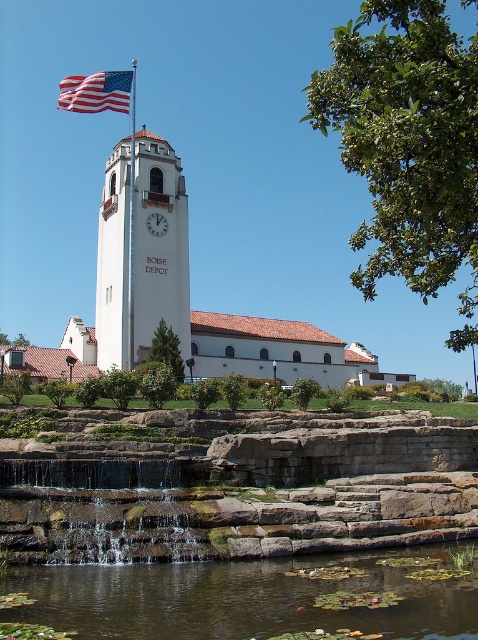
Question: Which point is farther from the camera taking this photo?

Choices:
 (A) (132, 323)
 (B) (108, 225)
 (C) (76, 582)
 (D) (147, 220)

Answer: (B)

Question: Observing the image, what is the correct spatial positioning of american flag at upper left in reference to metallic flagpole at upper left?

Choices:
 (A) right
 (B) left

Answer: (B)

Question: Which of these objects is positioned closest to the transparent water at lower center?

Choices:
 (A) white smooth clock tower at center
 (B) american flag at upper left
 (C) white matte clock at center
 (D) metallic flagpole at upper left

Answer: (D)

Question: Which point is farther to the camera?

Choices:
 (A) metallic flagpole at upper left
 (B) white matte clock at center

Answer: (B)

Question: Considering the relative positions of transparent water at lower center and metallic flagpole at upper left in the image provided, where is transparent water at lower center located with respect to metallic flagpole at upper left?

Choices:
 (A) left
 (B) right

Answer: (B)

Question: Is transparent water at lower center bigger than metallic flagpole at upper left?

Choices:
 (A) yes
 (B) no

Answer: (B)